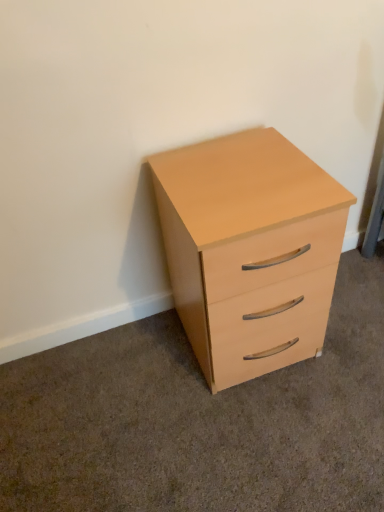
You are a GUI agent. You are given a task and a screenshot of the screen. Output one action in this format:
    pyautogui.click(x=<x>, y=<y>)
    Task: Click on the vacant area that is in front of light wood/finish chest of drawers at center
    This screenshot has width=384, height=512.
    Given the screenshot: What is the action you would take?
    pyautogui.click(x=260, y=439)